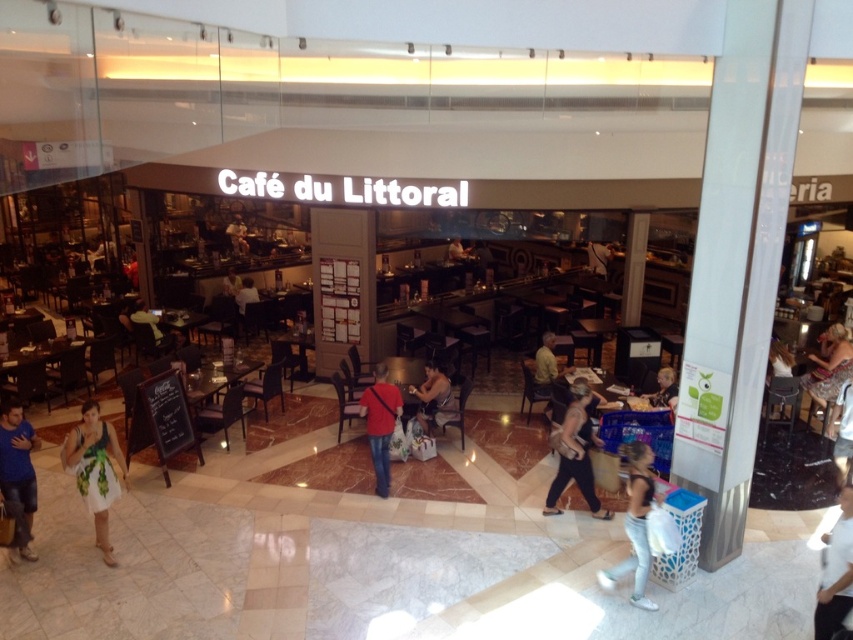
You are standing at the entrance of the mall and want to go to the point marked as point (831, 356). There is an obstacle at point (428, 372). Can you walk directly to your destination without going around the obstacle?

Point (831, 356) is behind point (428, 372), so you cannot walk directly to your destination without going around the obstacle.

From the picture: You are standing at the entrance of the mall and see the image. There is a point marked at coordinates (x=828, y=365). What is located at that point?

The point at coordinates (x=828, y=365) marks the location of light brown hair at upper right.

You are standing at the entrance of the mall and want to walk towards the point marked as point [440,388]. However, there is an obstacle at point [448,256]. Will you pass in front of or behind the obstacle?

Since point [440,388] is in front of point [448,256], you will pass in front of the obstacle at point [448,256] on your way to the destination.